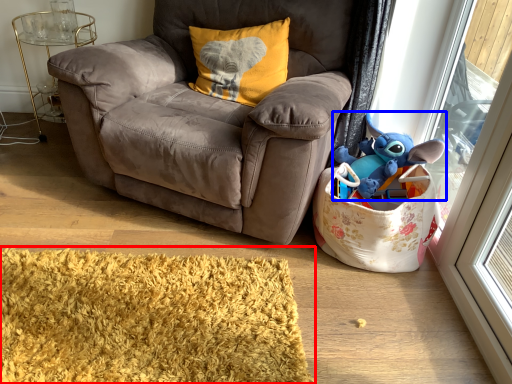
Question: Which object is further to the camera taking this photo, mat (highlighted by a red box) or toy (highlighted by a blue box)?

Choices:
 (A) mat
 (B) toy

Answer: (B)